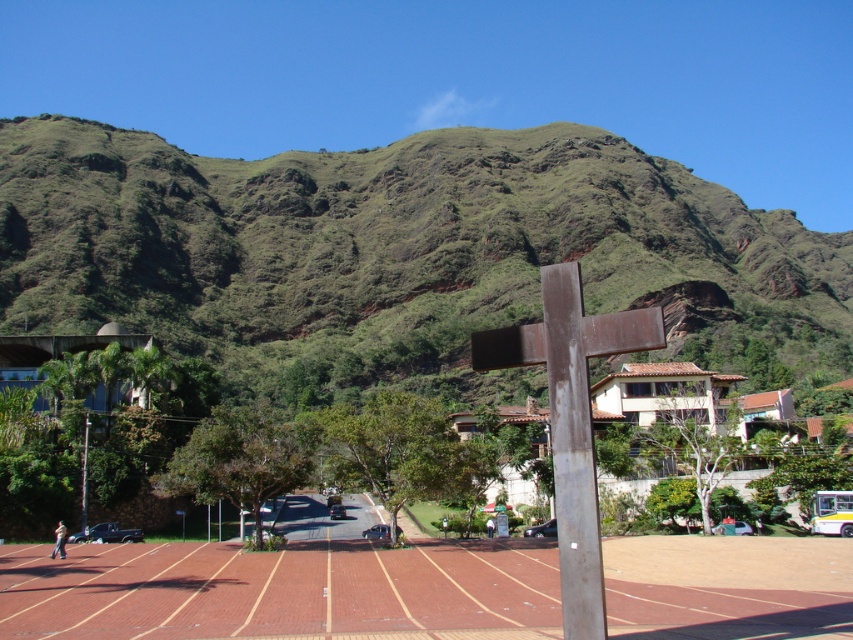
Question: Considering the real-world distances, which object is farthest from the brick textured race track at center?

Choices:
 (A) rusty metal cross at center
 (B) green grassy hill at upper center

Answer: (B)

Question: Estimate the real-world distances between objects in this image. Which object is closer to the rusty metal cross at center?

Choices:
 (A) green grassy hill at upper center
 (B) brick textured race track at center

Answer: (B)

Question: Does green grassy hill at upper center appear under rusty metal cross at center?

Choices:
 (A) yes
 (B) no

Answer: (B)

Question: Which object is positioned farthest from the brick textured race track at center?

Choices:
 (A) green grassy hill at upper center
 (B) rusty metal cross at center

Answer: (A)

Question: Does brick textured race track at center appear over rusty metal cross at center?

Choices:
 (A) no
 (B) yes

Answer: (A)

Question: Is green grassy hill at upper center closer to the viewer compared to brick textured race track at center?

Choices:
 (A) no
 (B) yes

Answer: (B)